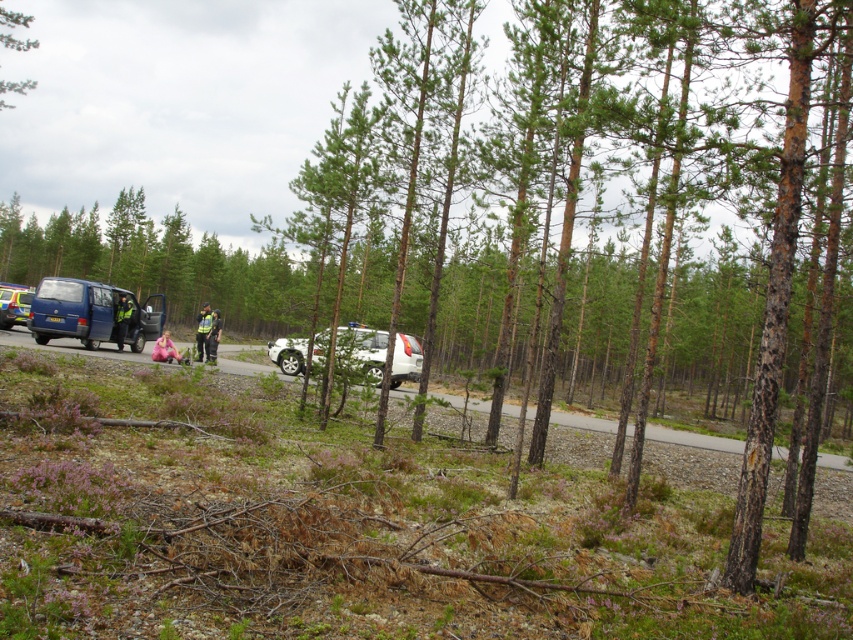
You are a hiker who dropped a white plastic bag at center while walking on the road. You want to pick it up without crossing the road. Can you reach it from your current position near the blue matte van at left?

The white plastic bag at center is wider than the blue matte van at left, so you can reach it without crossing the road since it is positioned closer to your location near the blue matte van at left.

You are a hiker who has just arrived at the roadside scene. You notice a white plastic bag at center and a blue matte van at left. Which object appears larger in the image?

The white plastic bag at center is taller than the blue matte van at left, so it appears larger in the image.

You are a pedestrian standing on the road and see the reflective silver helmet at center and the dark blue uniform at left. Which object is closer to you?

The reflective silver helmet at center is closer to you because it is positioned further to the viewer than the dark blue uniform at left.